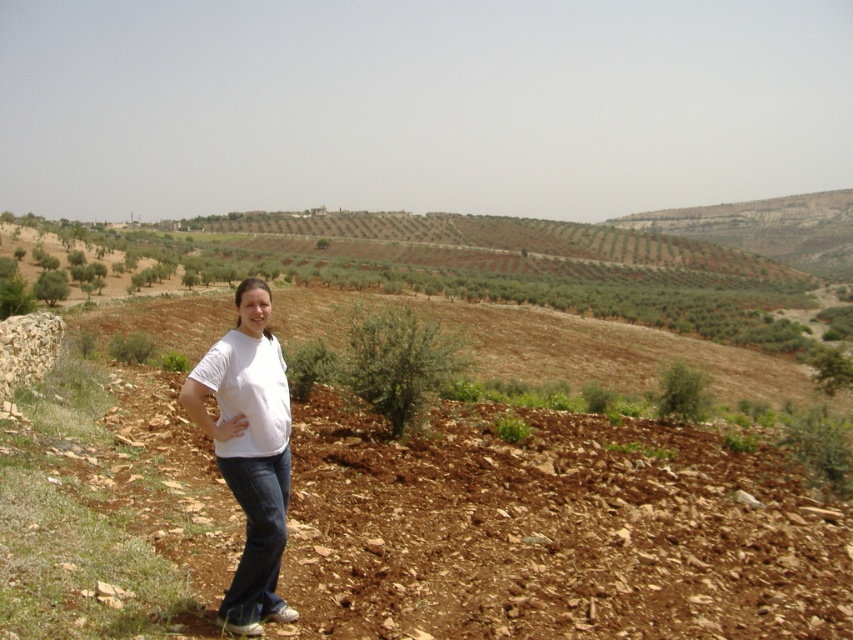
Question: Which of the following is the closest to the observer?

Choices:
 (A) tap(245, 444)
 (B) tap(767, 538)

Answer: (A)

Question: Considering the relative positions of brown rocky dirt track at center and white cotton shirt at center in the image provided, where is brown rocky dirt track at center located with respect to white cotton shirt at center?

Choices:
 (A) right
 (B) left

Answer: (A)

Question: In this image, where is brown rocky dirt track at center located relative to white cotton shirt at center?

Choices:
 (A) left
 (B) right

Answer: (B)

Question: Is brown rocky dirt track at center thinner than white cotton shirt at center?

Choices:
 (A) yes
 (B) no

Answer: (B)

Question: Which point is farther to the camera?

Choices:
 (A) (252, 522)
 (B) (512, 596)

Answer: (B)